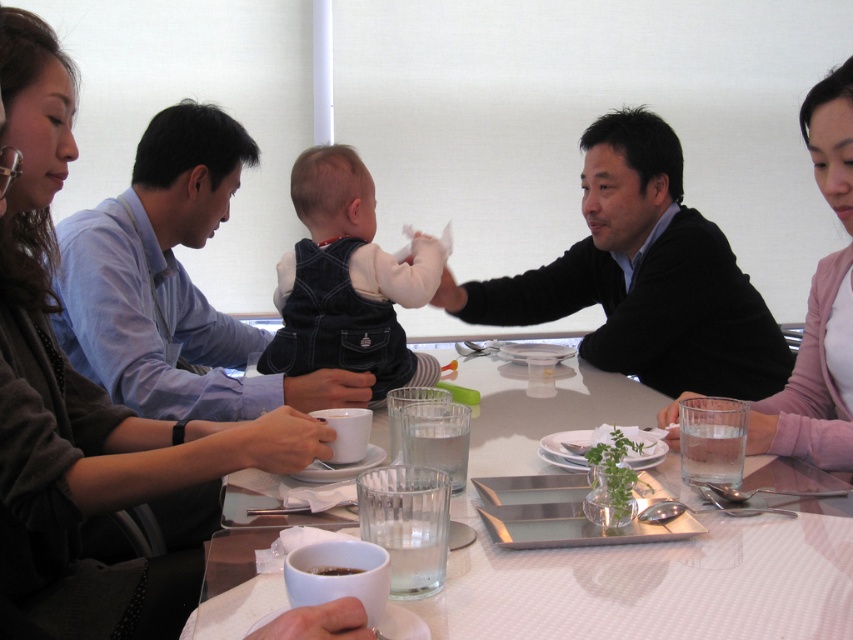
Can you confirm if matte black jacket at left is positioned above green leafy plant at center?

Yes, matte black jacket at left is above green leafy plant at center.

Which is more to the right, matte black jacket at left or green leafy plant at center?

green leafy plant at center

Which is in front, point (54, 109) or point (578, 449)?

Positioned in front is point (54, 109).

The width and height of the screenshot is (853, 640). Identify the location of matte black jacket at left. (91, 406).

Is denim overalls at center bigger than green leafy plant at center?

Yes.

This screenshot has height=640, width=853. Find the location of `denim overalls at center`. denim overalls at center is located at coordinates (347, 282).

Describe the element at coordinates (347, 282) in the screenshot. I see `denim overalls at center` at that location.

The image size is (853, 640). What are the coordinates of `denim overalls at center` in the screenshot? It's located at (347, 282).

Does black sweater at center lie in front of denim overalls at center?

That is False.

This screenshot has width=853, height=640. I want to click on black sweater at center, so click(643, 276).

Where is `black sweater at center`? This screenshot has width=853, height=640. black sweater at center is located at coordinates (643, 276).